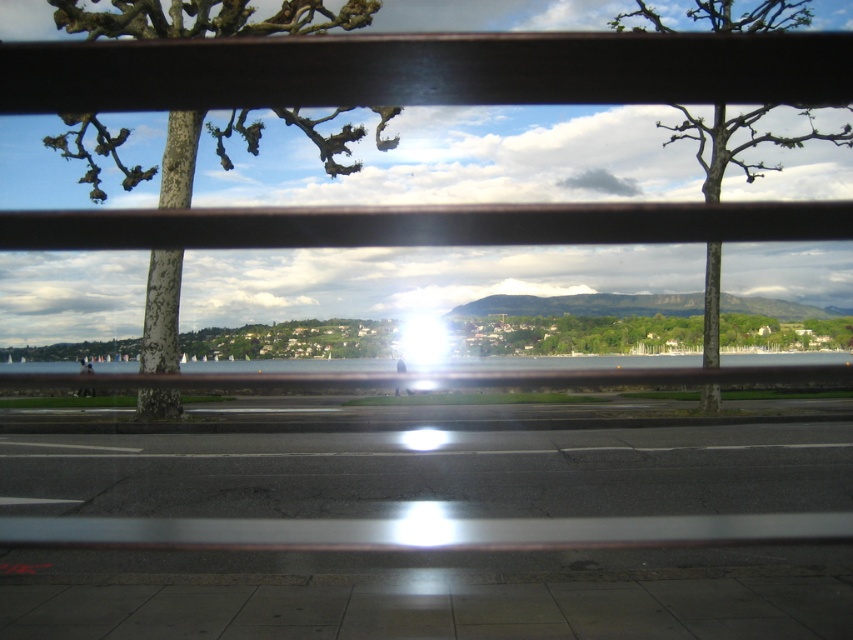
You are standing at the edge of the walkway and want to take a photo of the green rough bark tree at left. If your camera has a maximum focus range of 15 meters, will it be able to capture the tree clearly?

The green rough bark tree at left and camera are 14.79 meters apart, so yes, the camera can focus on the tree clearly since the distance is within the 15 meters maximum focus range.

You are a landscape architect analyzing the view through the metal railing. Which tree, the green rough bark tree at left or the bare wood tree at center, appears smaller in the scene?

The green rough bark tree at left appears smaller because it occupies less space than the bare wood tree at center.

You are standing on the walkway and want to see the clear water at center without the green rough bark tree at left blocking your view. Is there a way to adjust your position to achieve this?

The green rough bark tree at left is located above the clear water at center, so if you move to the right side of the walkway, you can position yourself below the tree to see the clear water at center without obstruction.